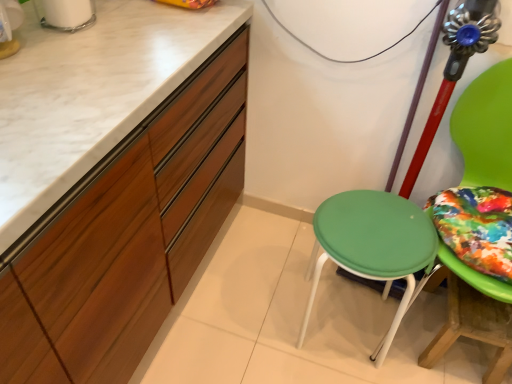
Question: Considering the relative positions of green plastic stool at center and wooden table at lower right in the image provided, is green plastic stool at center to the left or to the right of wooden table at lower right?

Choices:
 (A) left
 (B) right

Answer: (A)

Question: From the image's perspective, is green plastic stool at center positioned above or below wooden table at lower right?

Choices:
 (A) below
 (B) above

Answer: (B)

Question: Which is nearer to the wooden table at lower right?

Choices:
 (A) green plastic chair at right
 (B) green plastic stool at center
 (C) matte wood cabinetry at left

Answer: (B)

Question: Estimate the real-world distances between objects in this image. Which object is farther from the matte wood cabinetry at left?

Choices:
 (A) green plastic stool at center
 (B) green plastic chair at right
 (C) wooden table at lower right

Answer: (B)